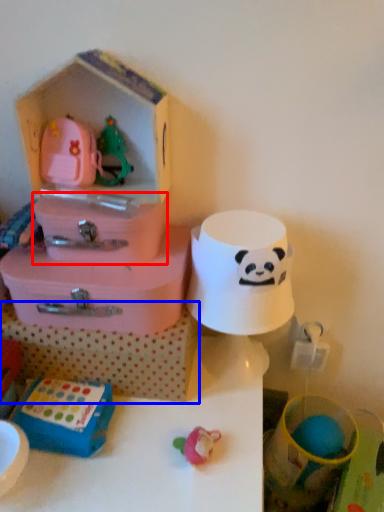
Question: Among these objects, which one is nearest to the camera, storage box (highlighted by a red box) or storage box (highlighted by a blue box)?

Choices:
 (A) storage box
 (B) storage box

Answer: (A)